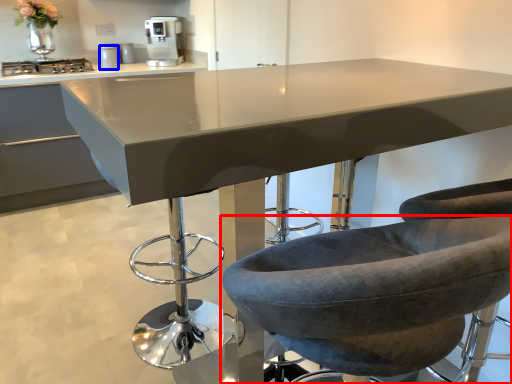
Question: Which point is closer to the camera, chair (highlighted by a red box) or appliance (highlighted by a blue box)?

Choices:
 (A) chair
 (B) appliance

Answer: (A)